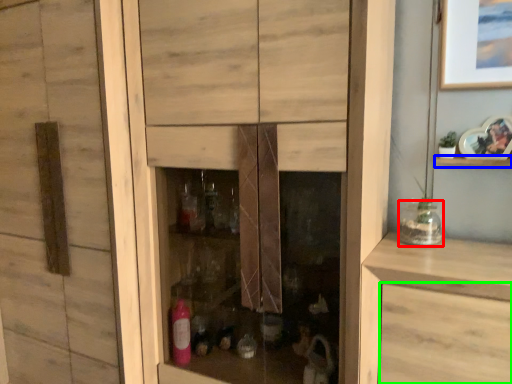
Question: Which object is positioned farthest from glass jar (highlighted by a red box)? Select from shelf (highlighted by a blue box) and drawer (highlighted by a green box).

Choices:
 (A) shelf
 (B) drawer

Answer: (B)